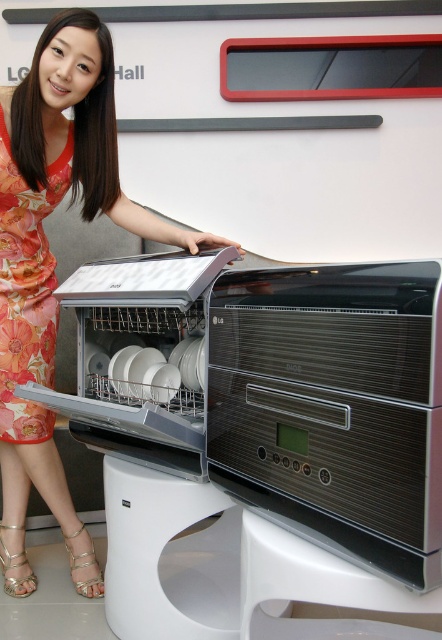
Question: Can you confirm if metallic silver dishwasher at center is positioned below floral silk dress at left?

Choices:
 (A) no
 (B) yes

Answer: (B)

Question: Can you confirm if floral dress at center is positioned above floral silk dress at left?

Choices:
 (A) no
 (B) yes

Answer: (A)

Question: Which of the following is the closest to the observer?

Choices:
 (A) (0, 378)
 (B) (69, 499)

Answer: (A)

Question: Which of the following is the farthest from the observer?

Choices:
 (A) (395, 320)
 (B) (368, 605)
 (C) (2, 186)
 (D) (25, 189)

Answer: (D)

Question: Is floral dress at center to the left of white plastic stool at lower center from the viewer's perspective?

Choices:
 (A) no
 (B) yes

Answer: (B)

Question: Among these points, which one is farthest from the camera?

Choices:
 (A) (33, 209)
 (B) (278, 552)
 (C) (80, 524)
 (D) (122, 397)

Answer: (C)